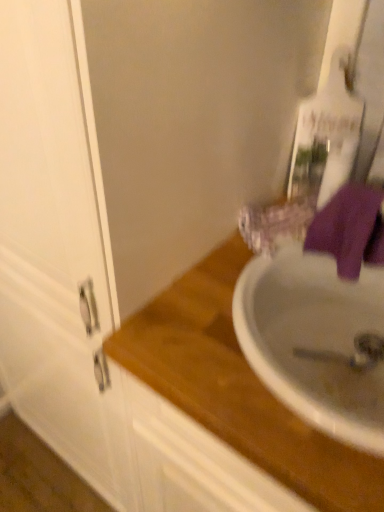
Locate an element on the screen. The width and height of the screenshot is (384, 512). vacant space that is to the left of purple fabric towel at right is located at coordinates (223, 292).